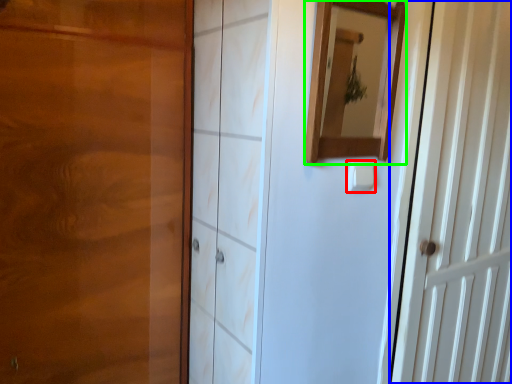
Question: Estimate the real-world distances between objects in this image. Which object is closer to light switch (highlighted by a red box), door (highlighted by a blue box) or mirror (highlighted by a green box)?

Choices:
 (A) door
 (B) mirror

Answer: (B)